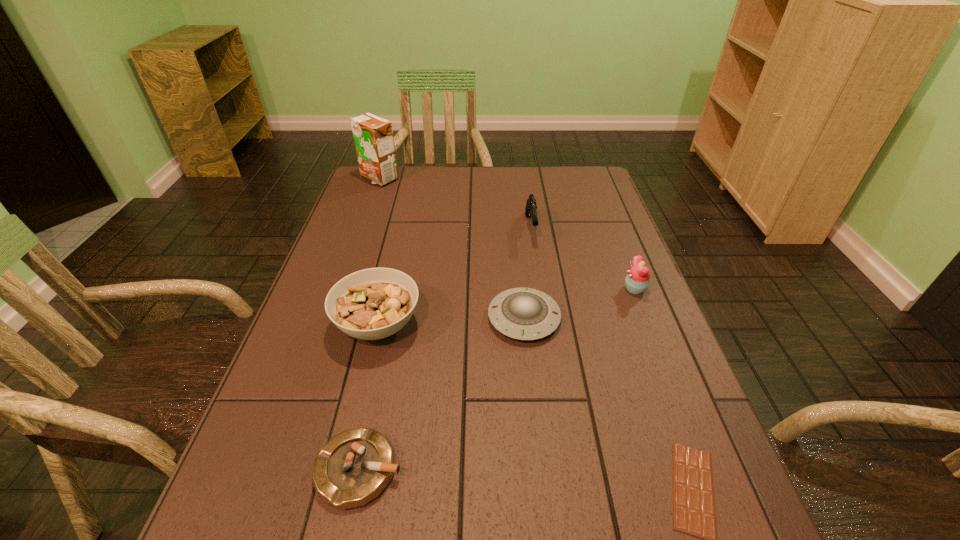
Find the location of a particular element. The image size is (960, 540). the tallest object is located at coordinates point(373,136).

Where is `the farthest object`? The height and width of the screenshot is (540, 960). the farthest object is located at coordinates (373, 136).

Where is `the sixth nearest object`? The height and width of the screenshot is (540, 960). the sixth nearest object is located at coordinates (530, 210).

Where is `cupcake`? The height and width of the screenshot is (540, 960). cupcake is located at coordinates (637, 280).

You are a GUI agent. You are given a task and a screenshot of the screen. Output one action in this format:
    pyautogui.click(x=<x>, y=<y>)
    Task: Click on the stew
    
    Given the screenshot: What is the action you would take?
    pyautogui.click(x=370, y=304)

Identify the location of the fifth tallest object. This screenshot has width=960, height=540. 520,313.

Identify the location of ashtray. (353, 468).

The width and height of the screenshot is (960, 540). In order to click on vacant space located on the straw side of the carton in this screenshot , I will do `click(351, 256)`.

What are the coordinates of `free space located 0.310m at the end of the barrel of the sixth nearest object` in the screenshot? It's located at (545, 328).

Locate an element on the screen. free location located 0.350m on the face of the cupcake is located at coordinates (484, 289).